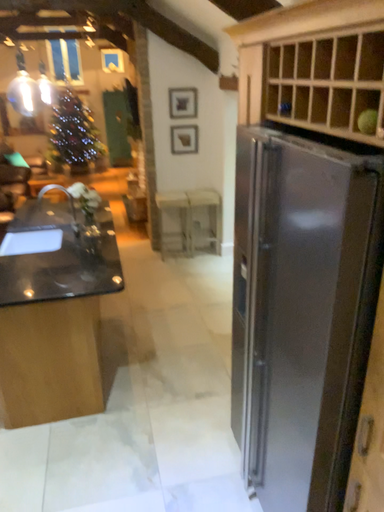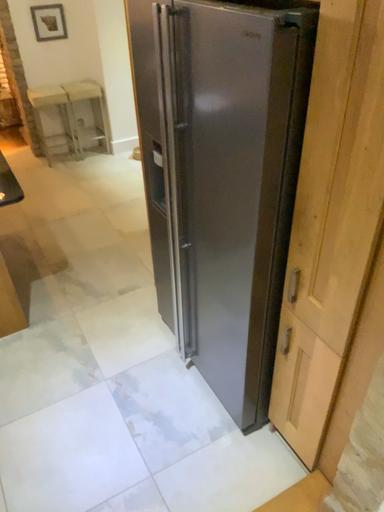
Question: Which way did the camera rotate in the video?

Choices:
 (A) rotated right
 (B) rotated left

Answer: (A)